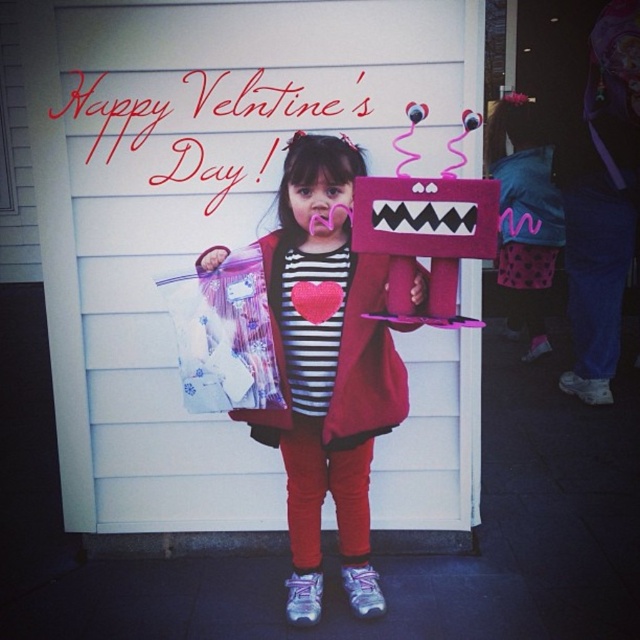
You are a photographer trying to capture the Valentine scene. You notice two plush toys in the image. Which one is closer to the camera, the matte pink plush toy at center or the felt plush toy at center?

The matte pink plush toy at center is closer to the camera because the felt plush toy at center is behind it.

You are a delivery robot that needs to place a package between the white wood garage door at center and the matte pink plush toy at center. The package is 18 inches long. Can you fit it between them?

The white wood garage door at center and the matte pink plush toy at center are 19.11 inches apart from each other. Since the package is 18 inches long, it can fit between them as there is enough space.

The scene shows a young girl holding a felt plush toy at center and standing in front of a white wood garage door at center. Which object is wider?

The white wood garage door at center is wider than the felt plush toy at center.